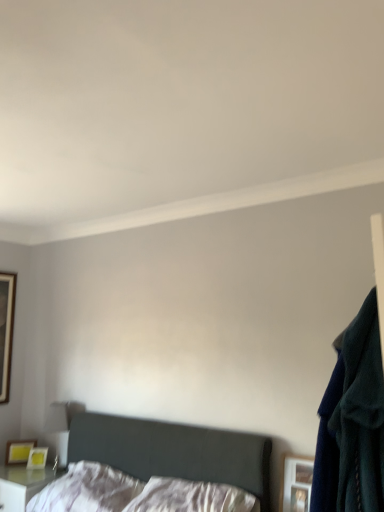
From the picture: What is the approximate height of matte yellow picture frame at lower left, arranged as the 2th picture frame when viewed from the left?

matte yellow picture frame at lower left, arranged as the 2th picture frame when viewed from the left, is 7.37 inches tall.

How much space does white soft pillow at lower center, the 1th pillow in the left-to-right sequence, occupy vertically?

white soft pillow at lower center, the 1th pillow in the left-to-right sequence, is 9.28 inches in height.

This screenshot has height=512, width=384. What do you see at coordinates (295, 483) in the screenshot? I see `wooden picture frame at lower right, the third picture frame positioned from the back` at bounding box center [295, 483].

Describe the element at coordinates (191, 497) in the screenshot. The width and height of the screenshot is (384, 512). I see `white satin pillow at center, arranged as the 1th pillow when viewed from the right` at that location.

At what (x,y) coordinates should I click in order to perform the action: click on matte yellow picture frame at lower left, which appears as the second picture frame when viewed from the front. Please return your answer as a coordinate pair (x, y). The height and width of the screenshot is (512, 384). Looking at the image, I should click on (19, 451).

Considering the sizes of objects matte yellow picture frame at lower left, the 2th picture frame in the right-to-left sequence, and white glossy nightstand at lower left in the image provided, who is thinner, matte yellow picture frame at lower left, the 2th picture frame in the right-to-left sequence, or white glossy nightstand at lower left?

With smaller width is matte yellow picture frame at lower left, the 2th picture frame in the right-to-left sequence.

From the image's perspective, which one is positioned higher, matte yellow picture frame at lower left, arranged as the 2th picture frame when viewed from the left, or white glossy nightstand at lower left?

matte yellow picture frame at lower left, arranged as the 2th picture frame when viewed from the left, is shown above in the image.

Considering the points (23, 462) and (8, 500), which point is in front, point (23, 462) or point (8, 500)?

The point (8, 500) is closer.

Does matte yellow picture frame at lower left, marked as the 3th picture frame in a top-to-bottom arrangement, come in front of wooden framed mirror at left, positioned as the first picture frame in left-to-right order?

Yes, matte yellow picture frame at lower left, marked as the 3th picture frame in a top-to-bottom arrangement, is closer to the camera.

What's the angular difference between matte yellow picture frame at lower left, placed as the 2th picture frame when sorted from back to front, and wooden framed mirror at left, which ranks as the 3th picture frame in bottom-to-top order,'s facing directions?

There is a 47-degree angle between the facing directions of matte yellow picture frame at lower left, placed as the 2th picture frame when sorted from back to front, and wooden framed mirror at left, which ranks as the 3th picture frame in bottom-to-top order.

From the image's perspective, which is below, matte yellow picture frame at lower left, placed as the 2th picture frame when sorted from back to front, or wooden framed mirror at left, which ranks as the 3th picture frame in bottom-to-top order?

From the image's view, matte yellow picture frame at lower left, placed as the 2th picture frame when sorted from back to front, is below.

Is wooden framed mirror at left, the third picture frame when ordered from front to back, not near dark gray fabric bed at lower left?

Yes, wooden framed mirror at left, the third picture frame when ordered from front to back, and dark gray fabric bed at lower left are located far from each other.

Which of these two, wooden framed mirror at left, arranged as the 1th picture frame when viewed from the top, or dark gray fabric bed at lower left, is smaller?

With smaller size is wooden framed mirror at left, arranged as the 1th picture frame when viewed from the top.

From a real-world perspective, is wooden framed mirror at left, arranged as the 1th picture frame when viewed from the top, positioned over dark gray fabric bed at lower left based on gravity?

Yes, from a real-world perspective, wooden framed mirror at left, arranged as the 1th picture frame when viewed from the top, is above dark gray fabric bed at lower left.

From a real-world perspective, who is located lower, wooden framed mirror at left, placed as the first picture frame when sorted from back to front, or navy blue sweater at right?

From a 3D spatial view, navy blue sweater at right is below.

How far apart are wooden framed mirror at left, placed as the first picture frame when sorted from back to front, and navy blue sweater at right?

They are 9.11 feet apart.

Is wooden framed mirror at left, which ranks as the 3th picture frame in bottom-to-top order, located outside navy blue sweater at right?

Absolutely, wooden framed mirror at left, which ranks as the 3th picture frame in bottom-to-top order, is external to navy blue sweater at right.

Does point (1, 381) lie in front of point (314, 468)?

No, (1, 381) is further to viewer.

Does white glossy nightstand at lower left have a larger size compared to dark gray fabric bed at lower left?

Actually, white glossy nightstand at lower left might be smaller than dark gray fabric bed at lower left.

Measure the distance from white glossy nightstand at lower left to dark gray fabric bed at lower left.

A distance of 25.05 inches exists between white glossy nightstand at lower left and dark gray fabric bed at lower left.

Is white glossy nightstand at lower left facing away from dark gray fabric bed at lower left?

No, white glossy nightstand at lower left is not facing the opposite direction of dark gray fabric bed at lower left.

Is white glossy nightstand at lower left not within dark gray fabric bed at lower left?

Yes, white glossy nightstand at lower left is not within dark gray fabric bed at lower left.

From a real-world perspective, who is located higher, wooden picture frame at lower right, acting as the second picture frame starting from the bottom, or matte yellow picture frame at lower left, marked as the 1th picture frame in a bottom-to-top arrangement?

wooden picture frame at lower right, acting as the second picture frame starting from the bottom, is physically above.

How different are the orientations of wooden picture frame at lower right, placed as the 1th picture frame when sorted from front to back, and matte yellow picture frame at lower left, marked as the 3th picture frame in a top-to-bottom arrangement, in degrees?

wooden picture frame at lower right, placed as the 1th picture frame when sorted from front to back, and matte yellow picture frame at lower left, marked as the 3th picture frame in a top-to-bottom arrangement, are facing 44.5 degrees away from each other.

The image size is (384, 512). I want to click on picture frame lying below the wooden picture frame at lower right, the third picture frame positioned from the back (from the image's perspective), so click(19, 451).

Between point (290, 464) and point (7, 456), which one is positioned in front?

The point (290, 464) is in front.

Between wooden picture frame at lower right, acting as the second picture frame starting from the bottom, and white glossy nightstand at lower left, which one appears on the left side from the viewer's perspective?

From the viewer's perspective, white glossy nightstand at lower left appears more on the left side.

Is wooden picture frame at lower right, acting as the second picture frame starting from the bottom, not near white glossy nightstand at lower left?

Indeed, wooden picture frame at lower right, acting as the second picture frame starting from the bottom, is not near white glossy nightstand at lower left.

Between wooden picture frame at lower right, placed as the 1th picture frame when sorted from front to back, and white glossy nightstand at lower left, which one has more height?

white glossy nightstand at lower left.

Identify the location of nightstand located underneath the wooden picture frame at lower right, the third picture frame positioned from the back (from a real-world perspective). The height and width of the screenshot is (512, 384). (23, 485).

You are a GUI agent. You are given a task and a screenshot of the screen. Output one action in this format:
    pyautogui.click(x=<x>, y=<y>)
    Task: Click on the nightstand below the matte yellow picture frame at lower left, the 2th picture frame in the right-to-left sequence (from a real-world perspective)
    This screenshot has height=512, width=384.
    Given the screenshot: What is the action you would take?
    pyautogui.click(x=23, y=485)

Find the location of `picture frame that is behind the matte yellow picture frame at lower left, arranged as the 2th picture frame when viewed from the left`. picture frame that is behind the matte yellow picture frame at lower left, arranged as the 2th picture frame when viewed from the left is located at coordinates (6, 330).

From the image, which object appears to be nearer to navy blue sweater at right, white satin pillow at center, which is counted as the 2th pillow, starting from the left, or matte yellow picture frame at lower left, which appears as the second picture frame when viewed from the front?

white satin pillow at center, which is counted as the 2th pillow, starting from the left, is positioned closer to the anchor navy blue sweater at right.

Looking at the image, which one is located further to white satin pillow at center, arranged as the 1th pillow when viewed from the right, white soft pillow at lower center, arranged as the second pillow when viewed from the right, or wooden picture frame at lower right, which is the 1th picture frame in right-to-left order?

wooden picture frame at lower right, which is the 1th picture frame in right-to-left order, is further to white satin pillow at center, arranged as the 1th pillow when viewed from the right.

Looking at the image, which one is located closer to white soft pillow at lower center, arranged as the second pillow when viewed from the right, wooden framed mirror at left, positioned as the first picture frame in left-to-right order, or wooden picture frame at lower right, the third picture frame positioned from the back?

Based on the image, wooden picture frame at lower right, the third picture frame positioned from the back, appears to be nearer to white soft pillow at lower center, arranged as the second pillow when viewed from the right.

From the image, which object appears to be nearer to white soft pillow at lower center, the 1th pillow in the left-to-right sequence, white satin pillow at center, which is counted as the 2th pillow, starting from the left, or wooden picture frame at lower right, the third picture frame positioned from the back?

white satin pillow at center, which is counted as the 2th pillow, starting from the left, lies closer to white soft pillow at lower center, the 1th pillow in the left-to-right sequence, than the other object.

Estimate the real-world distances between objects in this image. Which object is further from dark gray fabric bed at lower left, white satin pillow at center, arranged as the 1th pillow when viewed from the right, or navy blue sweater at right?

navy blue sweater at right.

From the image, which object appears to be farther from dark gray fabric bed at lower left, white satin pillow at center, arranged as the 1th pillow when viewed from the right, or wooden framed mirror at left, the third picture frame when ordered from front to back?

Based on the image, wooden framed mirror at left, the third picture frame when ordered from front to back, appears to be further to dark gray fabric bed at lower left.

Considering their positions, is matte yellow picture frame at lower left, arranged as the 2th picture frame when viewed from the left, positioned closer to navy blue sweater at right than white satin pillow at center, arranged as the 1th pillow when viewed from the right?

white satin pillow at center, arranged as the 1th pillow when viewed from the right.

Considering their positions, is navy blue sweater at right positioned further to wooden framed mirror at left, the third picture frame when ordered from front to back, than wooden picture frame at lower right, placed as the 1th picture frame when sorted from front to back?

navy blue sweater at right lies further to wooden framed mirror at left, the third picture frame when ordered from front to back, than the other object.

This screenshot has width=384, height=512. Find the location of `picture frame between matte yellow picture frame at lower left, the 2th picture frame in the right-to-left sequence, and navy blue sweater at right`. picture frame between matte yellow picture frame at lower left, the 2th picture frame in the right-to-left sequence, and navy blue sweater at right is located at coordinates (295, 483).

Locate an element on the screen. The height and width of the screenshot is (512, 384). picture frame between white soft pillow at lower center, the 1th pillow in the left-to-right sequence, and wooden framed mirror at left, placed as the first picture frame when sorted from back to front, from front to back is located at coordinates (19, 451).

The image size is (384, 512). I want to click on pillow located between dark gray fabric bed at lower left and white soft pillow at lower center, the 1th pillow in the left-to-right sequence, in the depth direction, so click(x=191, y=497).

This screenshot has width=384, height=512. I want to click on nightstand located between wooden framed mirror at left, placed as the first picture frame when sorted from back to front, and wooden picture frame at lower right, which is the 1th picture frame in right-to-left order, in the left-right direction, so click(x=23, y=485).